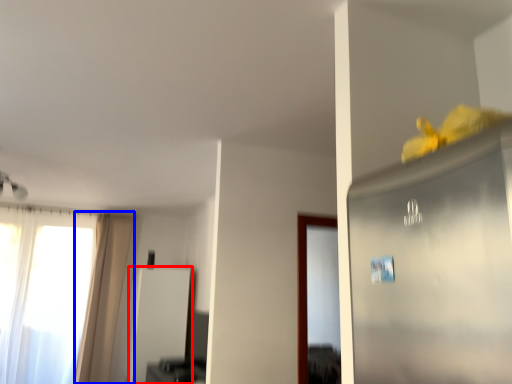
Question: Which object is closer to the camera taking this photo, screen door (highlighted by a red box) or curtain (highlighted by a blue box)?

Choices:
 (A) screen door
 (B) curtain

Answer: (A)